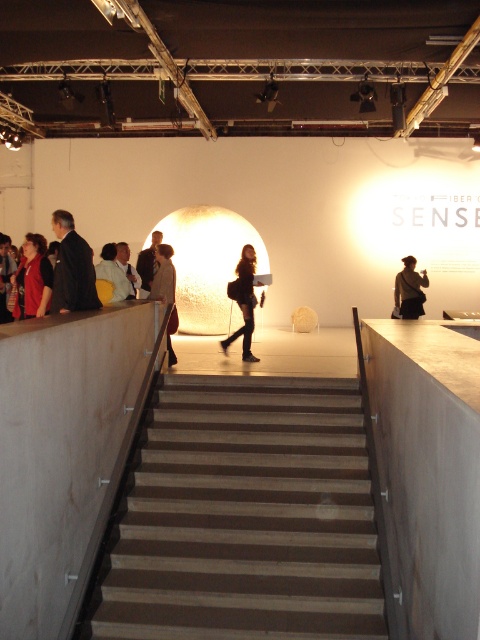
Locate an element on the screen. The image size is (480, 640). black leather jacket at center is located at coordinates (243, 301).

Is black leather jacket at center bigger than light beige suit at center?

Correct, black leather jacket at center is larger in size than light beige suit at center.

Is point (249, 262) more distant than point (119, 285)?

Yes, point (249, 262) is behind point (119, 285).

What are the coordinates of `black leather jacket at center` in the screenshot? It's located at (243, 301).

Between matte red shirt at left and matte black jacket at left, which one has more height?

Standing taller between the two is matte black jacket at left.

Does matte red shirt at left have a smaller size compared to matte black jacket at left?

Yes, matte red shirt at left is smaller than matte black jacket at left.

Does point (49, 275) lie behind point (11, 269)?

No, it is in front of (11, 269).

Locate an element on the screen. Image resolution: width=480 pixels, height=640 pixels. matte red shirt at left is located at coordinates [x=33, y=280].

Is black leather jacket at center to the right of matte black jacket at left from the viewer's perspective?

Correct, you'll find black leather jacket at center to the right of matte black jacket at left.

Locate an element on the screen. The height and width of the screenshot is (640, 480). black leather jacket at center is located at coordinates (243, 301).

Where is `black leather jacket at center`? black leather jacket at center is located at coordinates (243, 301).